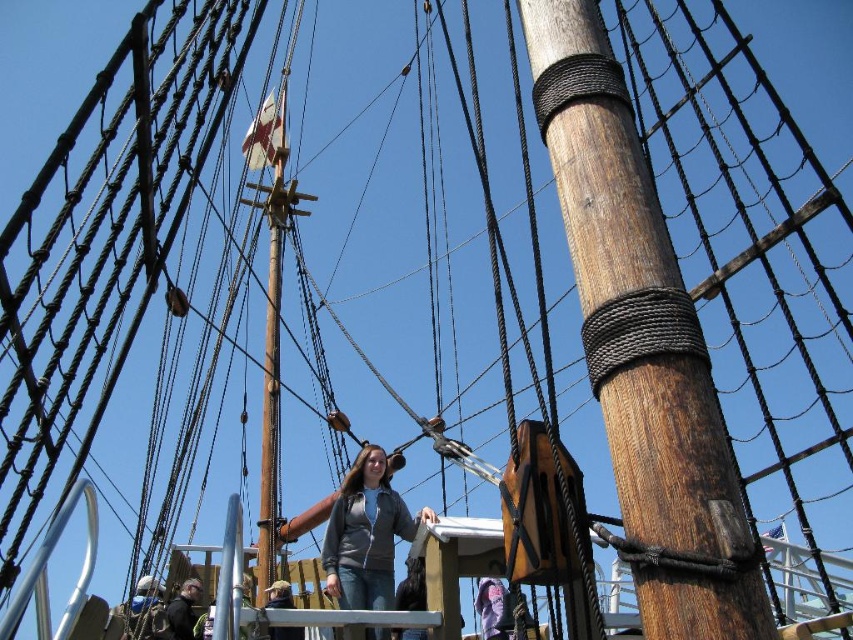
You are standing on the deck of the ship looking up at the mast. There are two points marked on the mast rigging at coordinates point (x=593, y=352) and point (x=334, y=541). Which point is nearer to your viewpoint?

Point (x=593, y=352) is closer to the camera than point (x=334, y=541), so the point (x=593, y=352) is nearer to your viewpoint.

You are a sailor on the ship and need to retrieve your jacket. You see the wooden pole at center and the gray matte jacket at center. Which object is positioned to the right side?

The wooden pole at center is to the right of the gray matte jacket at center.

You are a sailor on a ship and need to climb from the wooden pole at center to the gray matte jacket at center. Given that your climbing gear can only handle a maximum distance of 15 meters between anchor points, will you be able to safely make this climb?

The distance between the wooden pole at center and the gray matte jacket at center is 16.66 meters, which exceeds the climbing gear maximum of 15 meters. Therefore, it is not safe to make this climb without additional anchor points.